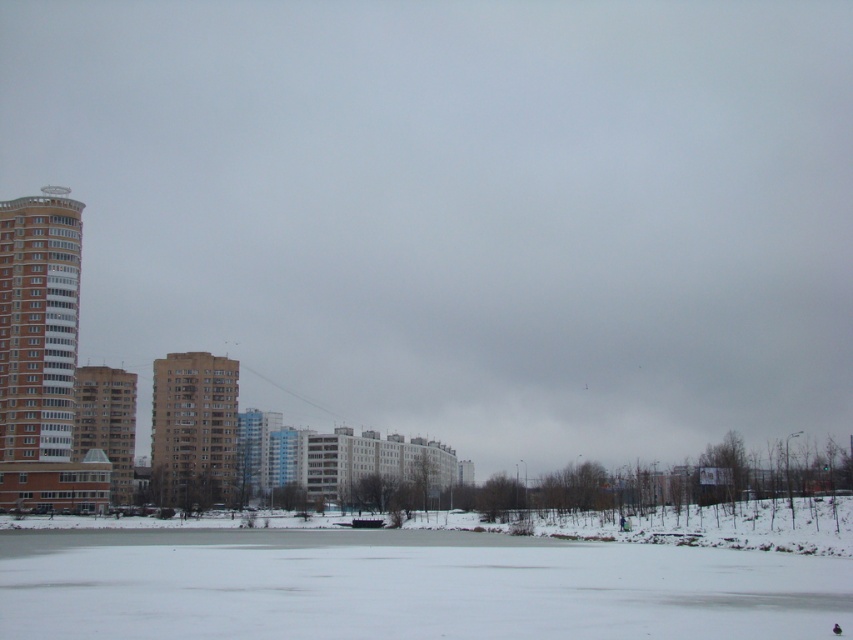
Question: Which object appears closest to the camera in this image?

Choices:
 (A) brown brick building at left
 (B) brown brick building at center

Answer: (A)

Question: Which is farther from the brown glossy building at left?

Choices:
 (A) brown brick building at center
 (B) brown brick building at left

Answer: (A)

Question: Is brown glossy building at left positioned before brown brick building at left?

Choices:
 (A) no
 (B) yes

Answer: (B)

Question: Does brown glossy building at left lie behind brown brick building at center?

Choices:
 (A) yes
 (B) no

Answer: (B)

Question: From the image, what is the correct spatial relationship of brown brick building at center in relation to brown brick building at left?

Choices:
 (A) above
 (B) below

Answer: (B)

Question: Among these points, which one is farthest from the camera?

Choices:
 (A) (38, 508)
 (B) (90, 436)
 (C) (193, 477)

Answer: (B)